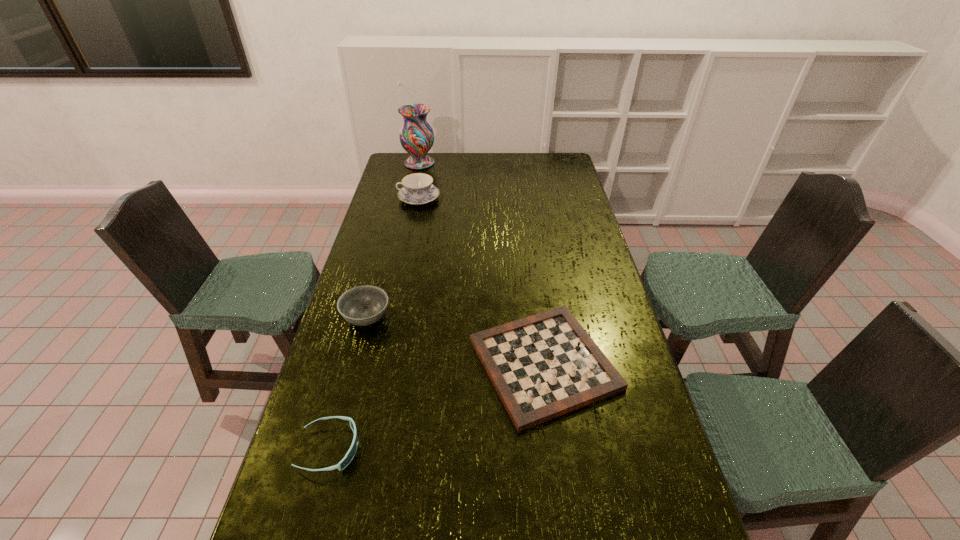
You are a GUI agent. You are given a task and a screenshot of the screen. Output one action in this format:
    pyautogui.click(x=<x>, y=<y>)
    Task: Click on the free spot between the bowl and the farthest object
    
    Given the screenshot: What is the action you would take?
    pyautogui.click(x=393, y=240)

Image resolution: width=960 pixels, height=540 pixels. What are the coordinates of `object that stands as the third closest to the rightmost object` in the screenshot? It's located at (418, 189).

Select which object is the fourth closest to the farthest object. Please provide its 2D coordinates. Your answer should be formatted as a tuple, i.e. [(x, y)], where the tuple contains the x and y coordinates of a point satisfying the conditions above.

[(350, 454)]

I want to click on vacant region that satisfies the following two spatial constraints: 1. on the front side of the vase; 2. with the handle on the side of the fourth shortest object, so click(412, 198).

At what (x,y) coordinates should I click in order to perform the action: click on vacant space that satisfies the following two spatial constraints: 1. on the front side of the vase; 2. with the handle on the side of the fourth nearest object. Please return your answer as a coordinate pair (x, y). The height and width of the screenshot is (540, 960). Looking at the image, I should click on (412, 198).